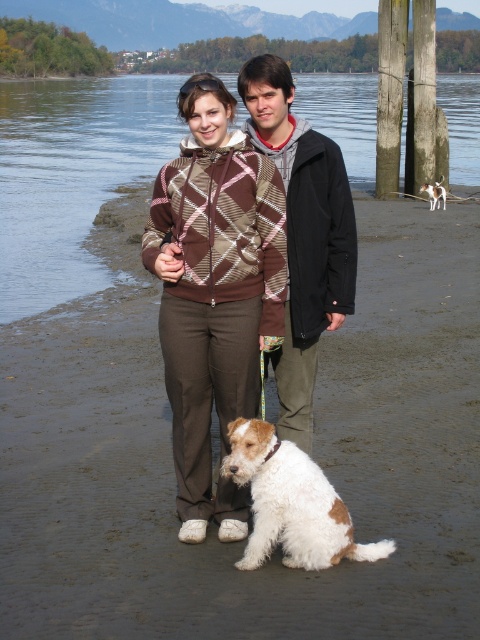
Does clear water at lower left appear on the right side of black fleece jacket at center?

Yes, clear water at lower left is to the right of black fleece jacket at center.

Can you confirm if clear water at lower left is smaller than black fleece jacket at center?

Actually, clear water at lower left might be larger than black fleece jacket at center.

Is point (98, 204) positioned behind point (345, 227)?

Yes, point (98, 204) is farther from viewer.

Where is `clear water at lower left`? The height and width of the screenshot is (640, 480). clear water at lower left is located at coordinates (72, 176).

Describe the element at coordinates (313, 456) in the screenshot. I see `brown fabric pants at center` at that location.

Does brown fabric pants at center appear over brown diamond-patterned sweater at center?

No, brown fabric pants at center is not above brown diamond-patterned sweater at center.

Measure the distance between point (123, 326) and camera.

Point (123, 326) is 7.69 meters from camera.

Identify the location of brown fabric pants at center. Image resolution: width=480 pixels, height=640 pixels. (313, 456).

Is point (277, 451) positioned before point (439, 189)?

Yes, point (277, 451) is in front of point (439, 189).

Can you confirm if white-furred dog at lower center is thinner than white fur at lower center?

No.

Between point (263, 525) and point (439, 196), which one is positioned behind?

The point (439, 196) is more distant.

Where is `white-furred dog at lower center`? Image resolution: width=480 pixels, height=640 pixels. white-furred dog at lower center is located at coordinates (290, 502).